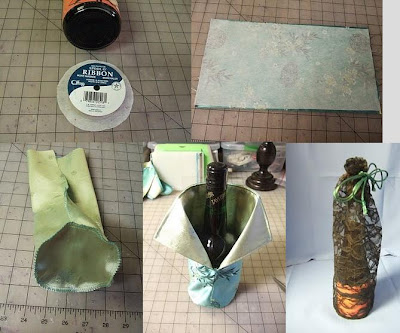
I want to click on bottles, so (x=214, y=198), (x=354, y=249), (x=81, y=23).